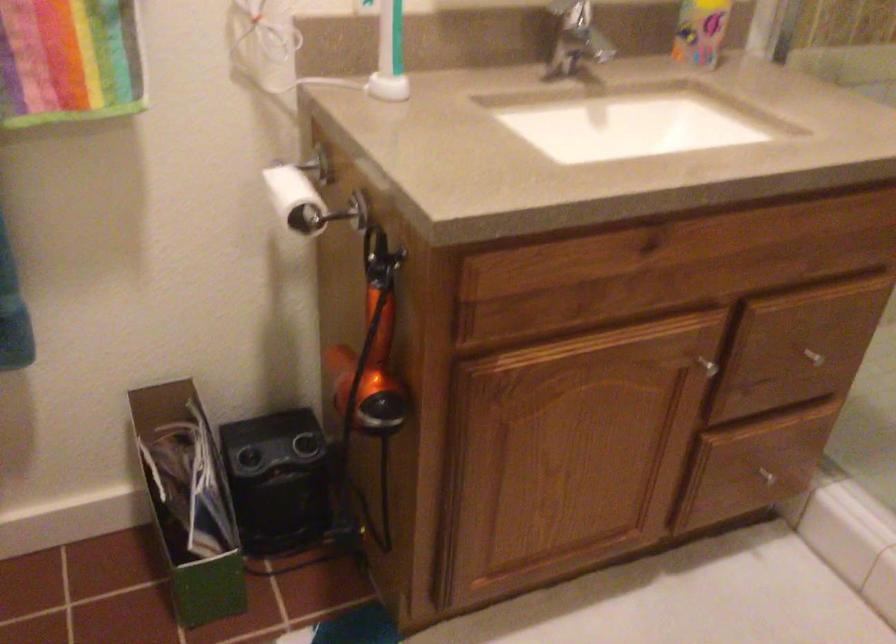
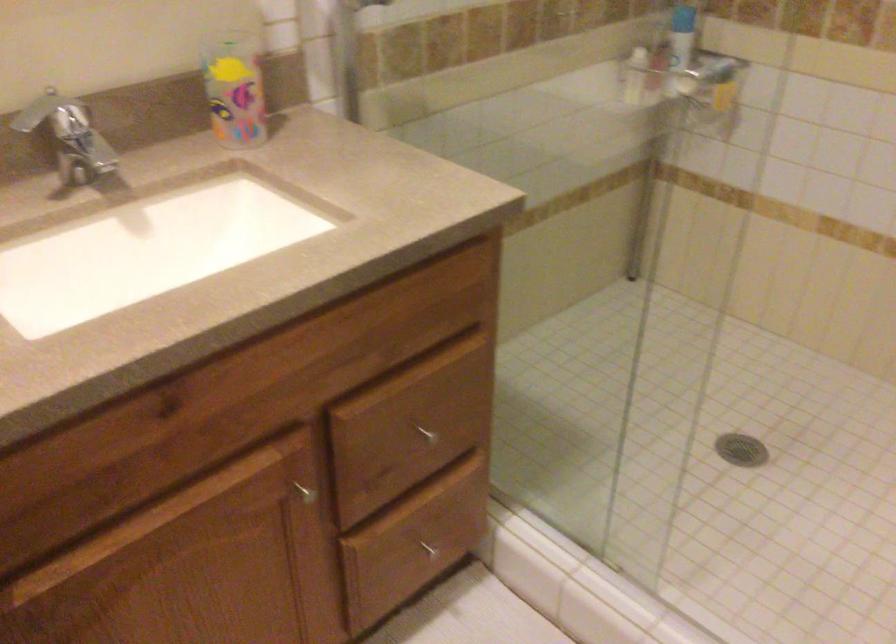
Question: What movement of the cameraman would produce the second image?

Choices:
 (A) Left
 (B) Right
 (C) Forward
 (D) Backward

Answer: (B)